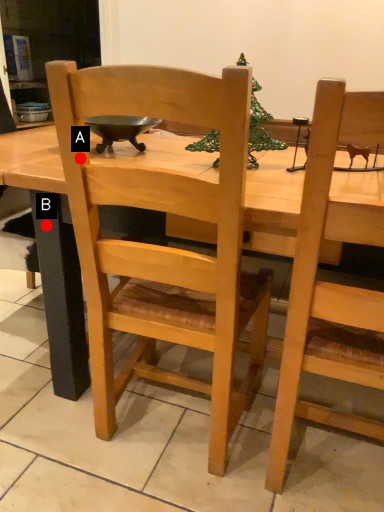
Question: Two points are circled on the image, labeled by A and B beside each circle. Which point is closer to the camera?

Choices:
 (A) A is closer
 (B) B is closer

Answer: (A)